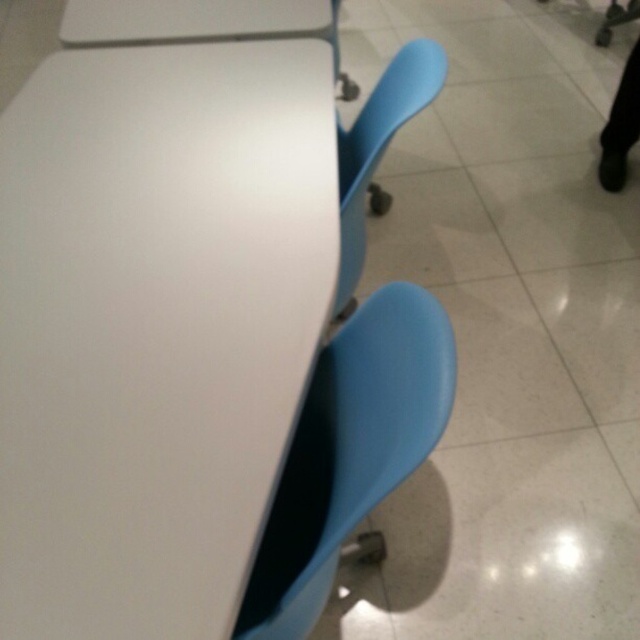
Which is in front, point (218, 424) or point (372, 205)?

Positioned in front is point (218, 424).

Does white glossy table at center appear under matte plastic swivel chair at center?

Indeed, white glossy table at center is positioned under matte plastic swivel chair at center.

Does point (19, 504) come in front of point (381, 97)?

Yes, it is.

You are a GUI agent. You are given a task and a screenshot of the screen. Output one action in this format:
    pyautogui.click(x=<x>, y=<y>)
    Task: Click on the white glossy table at center
    This screenshot has width=640, height=640.
    Given the screenshot: What is the action you would take?
    pyautogui.click(x=156, y=324)

Who is shorter, white glossy table at center or matte blue swivel chair at lower right?

Standing shorter between the two is matte blue swivel chair at lower right.

How distant is white glossy table at center from matte blue swivel chair at lower right?

The distance of white glossy table at center from matte blue swivel chair at lower right is 30.54 centimeters.

Between point (61, 616) and point (317, 554), which one is positioned behind?

Positioned behind is point (317, 554).

Where is `white glossy table at center`? Image resolution: width=640 pixels, height=640 pixels. white glossy table at center is located at coordinates (156, 324).

Is matte blue swivel chair at lower right to the right of matte plastic swivel chair at center from the viewer's perspective?

Incorrect, matte blue swivel chair at lower right is not on the right side of matte plastic swivel chair at center.

Who is shorter, matte blue swivel chair at lower right or matte plastic swivel chair at center?

matte blue swivel chair at lower right is shorter.

Find the location of a particular element. Image resolution: width=640 pixels, height=640 pixels. matte blue swivel chair at lower right is located at coordinates (349, 449).